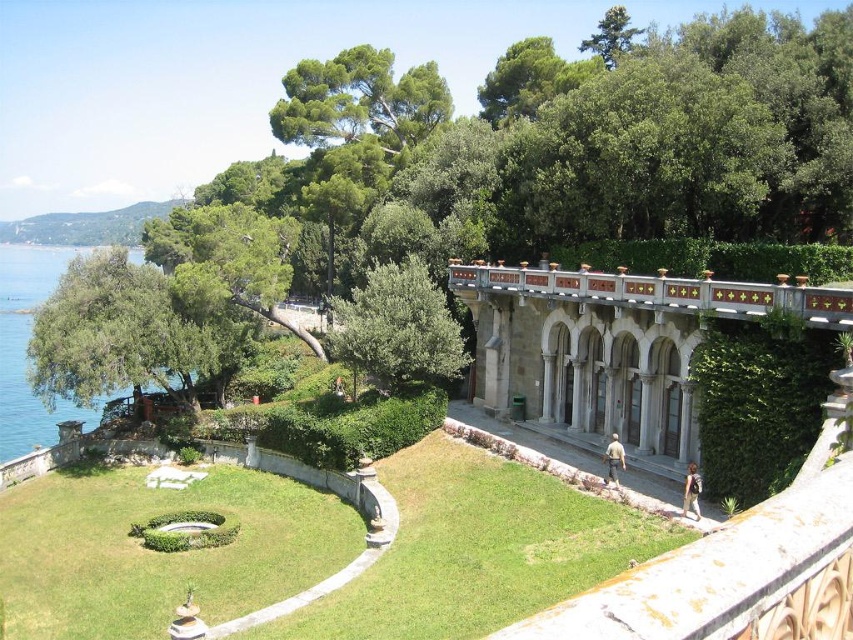
Can you confirm if green leafy tree at center is thinner than green water at left?

Yes, green leafy tree at center is thinner than green water at left.

Does green leafy tree at center appear under green water at left?

Yes.

Where is `green leafy tree at center`? green leafy tree at center is located at coordinates (397, 326).

Is green leafy tree at upper left bigger than green leafy hedge at center-right?

Yes, green leafy tree at upper left is bigger than green leafy hedge at center-right.

Between green leafy tree at upper left and green leafy hedge at center-right, which one appears on the left side from the viewer's perspective?

green leafy tree at upper left

Describe the element at coordinates (647, 150) in the screenshot. This screenshot has width=853, height=640. I see `green leafy tree at upper left` at that location.

This screenshot has height=640, width=853. Find the location of `green leafy tree at upper left`. green leafy tree at upper left is located at coordinates [x=647, y=150].

Is green leafy hedge at center-right to the left of green leafy tree at center from the viewer's perspective?

In fact, green leafy hedge at center-right is to the right of green leafy tree at center.

Is green leafy hedge at center-right to the right of green leafy tree at center from the viewer's perspective?

Indeed, green leafy hedge at center-right is positioned on the right side of green leafy tree at center.

Who is more distant from viewer, (811, 384) or (364, 317)?

Point (364, 317)

You are a GUI agent. You are given a task and a screenshot of the screen. Output one action in this format:
    pyautogui.click(x=<x>, y=<y>)
    Task: Click on the green leafy hedge at center-right
    This screenshot has height=640, width=853.
    Given the screenshot: What is the action you would take?
    pyautogui.click(x=758, y=403)